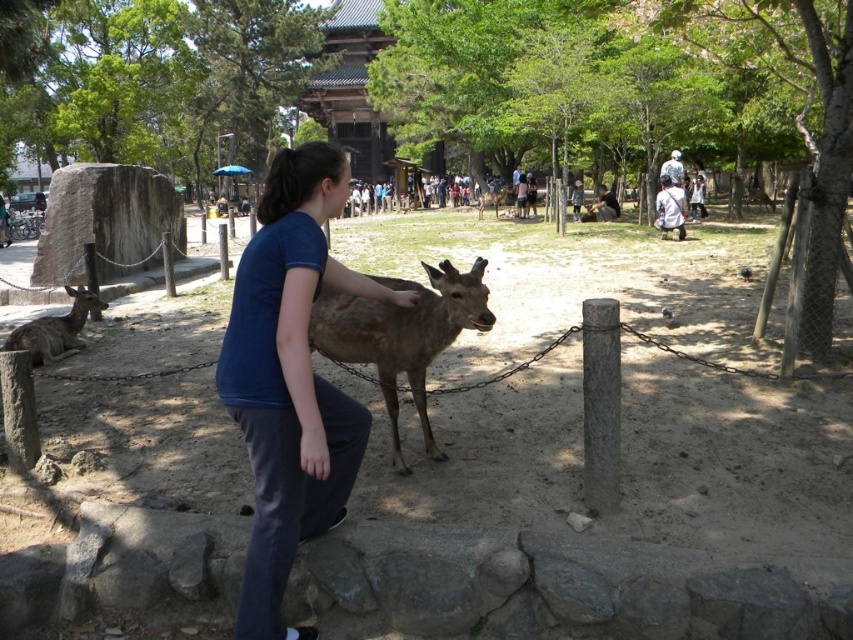
Can you confirm if blue cotton shirt at center is positioned to the left of brown matte deer at center?

Yes, blue cotton shirt at center is to the left of brown matte deer at center.

Based on the photo, who is shorter, blue cotton shirt at center or brown matte deer at center?

brown matte deer at center

Which is in front, point (325, 276) or point (503, 196)?

Point (325, 276) is in front.

The width and height of the screenshot is (853, 640). Find the location of `blue cotton shirt at center`. blue cotton shirt at center is located at coordinates (289, 378).

Consider the image. Can you confirm if blue cotton shirt at center is smaller than brown matte/deer at center?

Yes.

Does point (326, 147) lie in front of point (439, 282)?

That is True.

Between point (227, 385) and point (343, 300), which one is positioned behind?

Point (343, 300)

At what (x,y) coordinates should I click in order to perform the action: click on blue cotton shirt at center. Please return your answer as a coordinate pair (x, y). Looking at the image, I should click on (289, 378).

Between point (425, 316) and point (498, 189), which one is positioned in front?

Point (425, 316) is in front.

Between brown matte/deer at center and brown matte deer at center, which one is positioned higher?

brown matte deer at center

Is point (437, 269) positioned before point (503, 188)?

Yes, it is.

Locate an element on the screen. The image size is (853, 640). brown matte/deer at center is located at coordinates (401, 333).